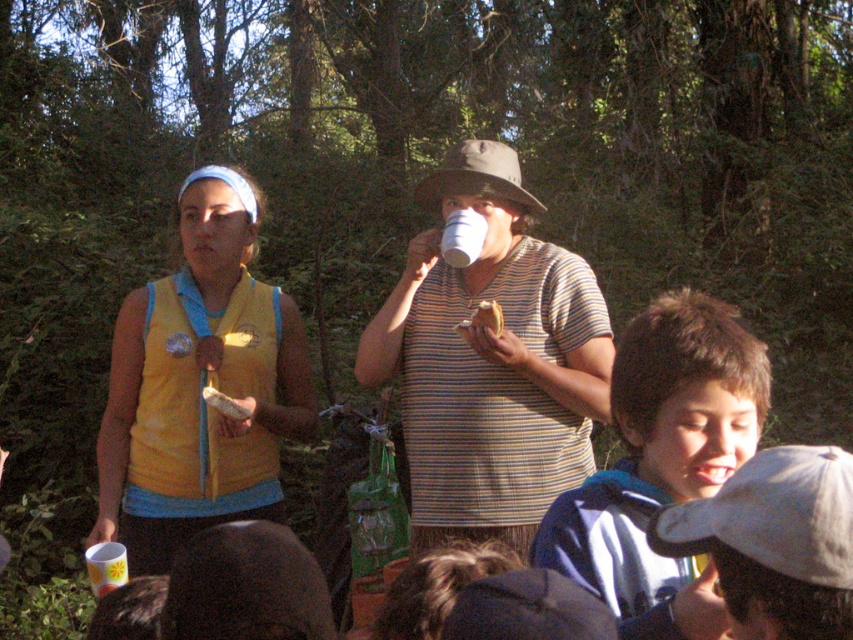
Can you confirm if striped cotton shirt at center is positioned above yellow fabric vest at left?

Indeed, striped cotton shirt at center is positioned over yellow fabric vest at left.

Between point (428, 243) and point (117, 460), which one is positioned in front?

Point (428, 243)

What do you see at coordinates (490, 362) in the screenshot? Image resolution: width=853 pixels, height=640 pixels. I see `striped cotton shirt at center` at bounding box center [490, 362].

I want to click on striped cotton shirt at center, so click(490, 362).

Between point (511, 374) and point (643, 401), which one is positioned behind?

Positioned behind is point (511, 374).

Is striped cotton shirt at center positioned at the back of blue fleece jacket at center?

Yes, striped cotton shirt at center is further from the viewer.

The width and height of the screenshot is (853, 640). What do you see at coordinates (490, 362) in the screenshot?
I see `striped cotton shirt at center` at bounding box center [490, 362].

You are a GUI agent. You are given a task and a screenshot of the screen. Output one action in this format:
    pyautogui.click(x=<x>, y=<y>)
    Task: Click on the striped cotton shirt at center
    
    Given the screenshot: What is the action you would take?
    pyautogui.click(x=490, y=362)

Which is in front, point (715, 611) or point (463, 246)?

Positioned in front is point (715, 611).

Where is `blue fleece jacket at center`? blue fleece jacket at center is located at coordinates (660, 460).